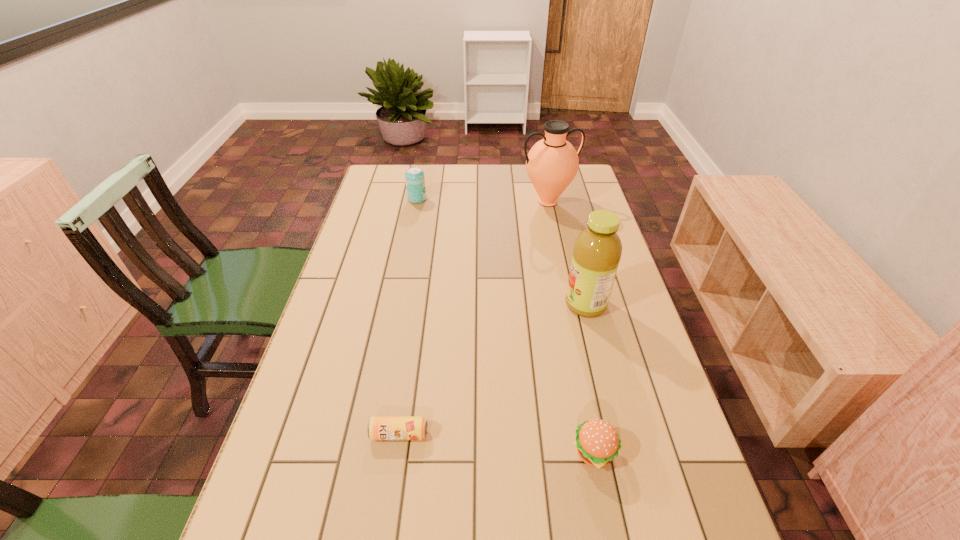
I want to click on free area in between the third nearest object and the shortest object, so click(492, 369).

This screenshot has height=540, width=960. Identify the location of free point between the shortest object and the hamburger. (497, 443).

This screenshot has height=540, width=960. Identify the location of blank region between the fruit juice and the nearer beer can. (492, 369).

Image resolution: width=960 pixels, height=540 pixels. I want to click on free space between the fourth tallest object and the pitcher, so click(x=571, y=327).

You are a GUI agent. You are given a task and a screenshot of the screen. Output one action in this format:
    pyautogui.click(x=<x>, y=<y>)
    Task: Click on the third closest object to the pitcher
    
    Given the screenshot: What is the action you would take?
    pyautogui.click(x=597, y=442)

Where is `object that is the third nearest to the shorter beer can`? This screenshot has height=540, width=960. object that is the third nearest to the shorter beer can is located at coordinates (552, 163).

You are a GUI agent. You are given a task and a screenshot of the screen. Output one action in this format:
    pyautogui.click(x=<x>, y=<y>)
    Task: Click on the blank space that satisfies the following two spatial constraints: 1. on the front side of the farther beer can; 2. on the right side of the pitcher
    
    Given the screenshot: What is the action you would take?
    pyautogui.click(x=417, y=202)

Locate an element on the screen. free space in the image that satisfies the following two spatial constraints: 1. on the back side of the pitcher; 2. on the left side of the fourth tallest object is located at coordinates (544, 202).